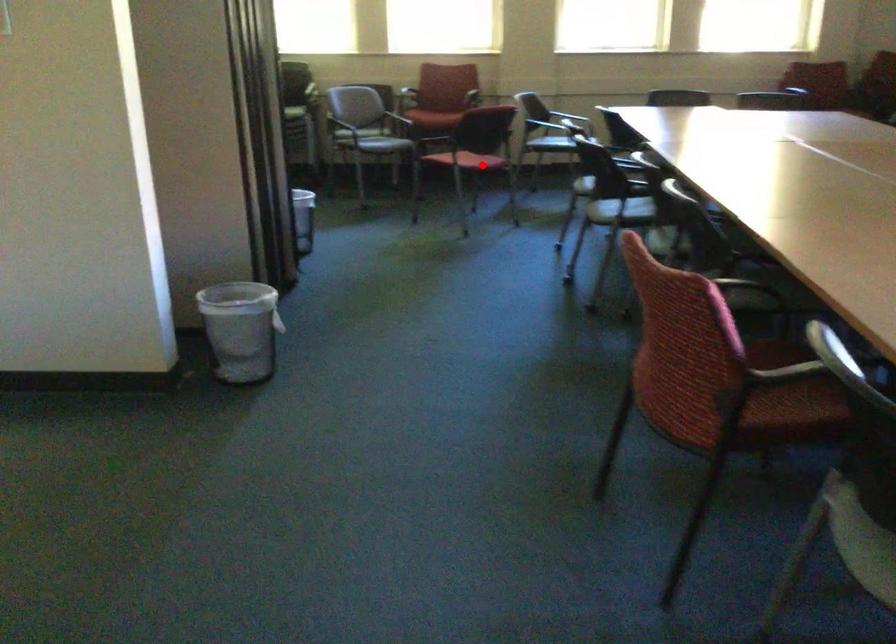
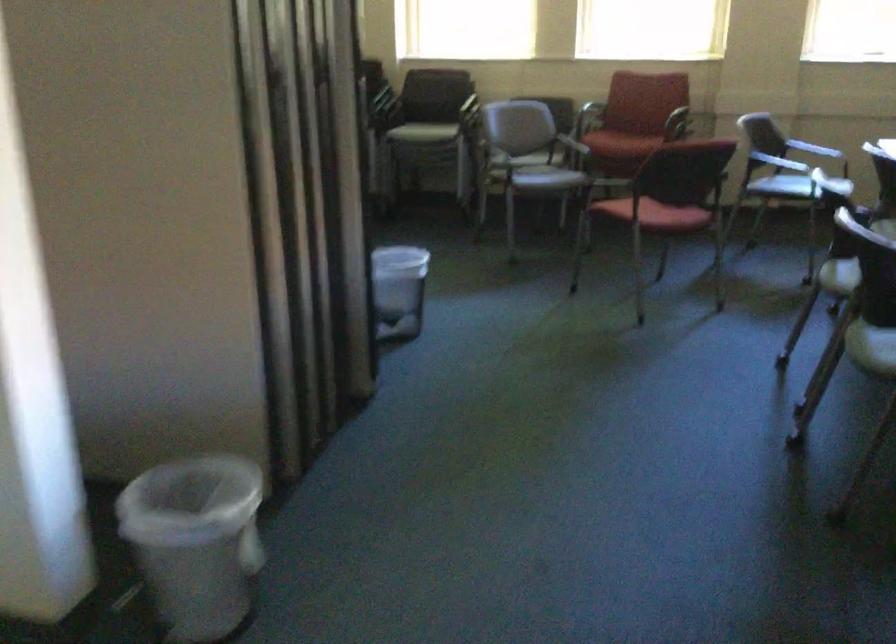
Question: I am providing you with two images of the same scene from different viewpoints. Image1 has a red point marked. In image2, the corresponding 3D location appears at what relative position? Reply with the corresponding letter.

Choices:
 (A) Closer
 (B) Farther

Answer: (A)